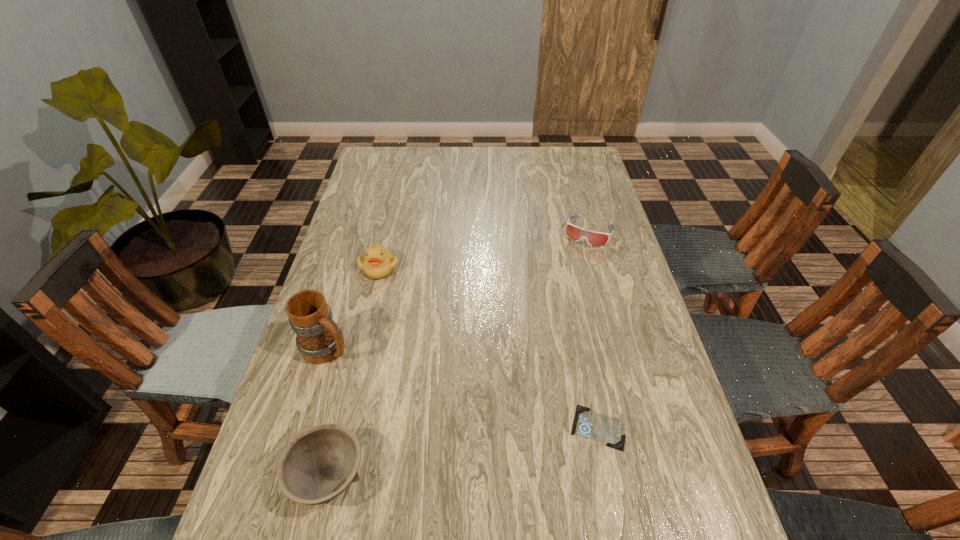
This screenshot has height=540, width=960. Identify the location of bowl. (320, 463).

The width and height of the screenshot is (960, 540). I want to click on the shortest object, so click(x=609, y=430).

You are a GUI agent. You are given a task and a screenshot of the screen. Output one action in this format:
    pyautogui.click(x=<x>, y=<y>)
    Task: Click on the third nearest object
    Image resolution: width=960 pixels, height=540 pixels.
    Given the screenshot: What is the action you would take?
    pyautogui.click(x=319, y=339)

Locate an element on the screen. mug is located at coordinates (319, 339).

This screenshot has width=960, height=540. In order to click on the second farthest object in this screenshot , I will do `click(378, 263)`.

The image size is (960, 540). Identify the location of duckling. (378, 263).

The height and width of the screenshot is (540, 960). I want to click on goggles, so (x=593, y=238).

This screenshot has height=540, width=960. Identify the location of the fourth tallest object. (593, 238).

You are a GUI agent. You are given a task and a screenshot of the screen. Output one action in this format:
    pyautogui.click(x=<x>, y=<y>)
    Task: Click on the blank area located 0.060m on the right of the third shortest object
    The image size is (960, 540).
    Given the screenshot: What is the action you would take?
    [x=397, y=476]

I want to click on vacant region located on the right of the identity card, so click(x=661, y=428).